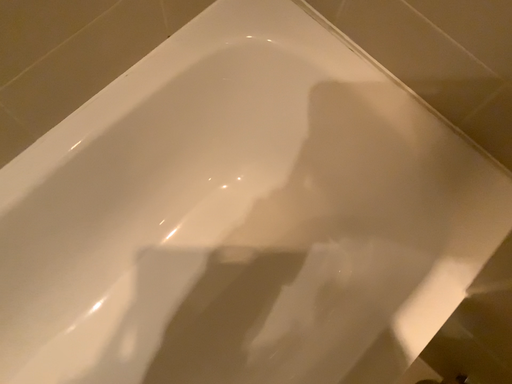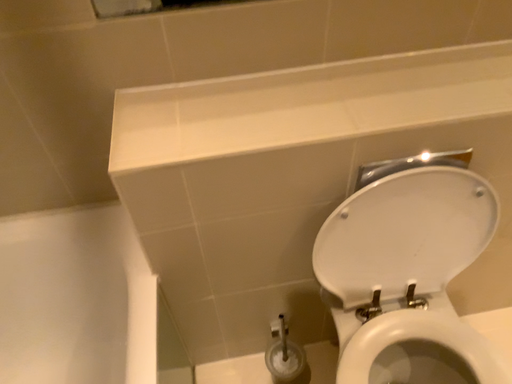
Question: Which way did the camera rotate in the video?

Choices:
 (A) rotated left
 (B) rotated right

Answer: (B)